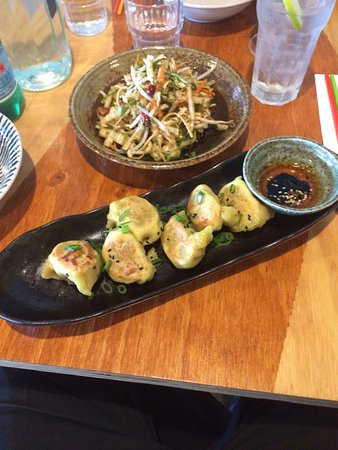
Where is `green bottle with label on it sitting on table`? This screenshot has width=338, height=450. green bottle with label on it sitting on table is located at coordinates (13, 102).